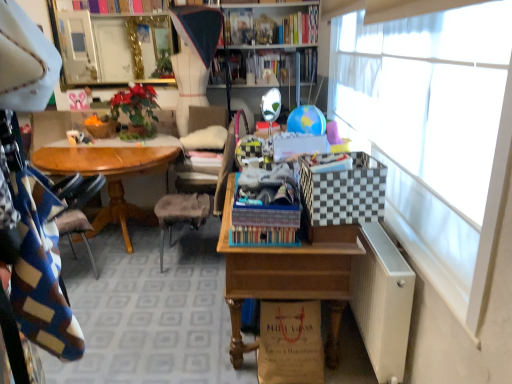
Question: From a real-world perspective, is wooden desk at center positioned over white metallic radiator at lower right based on gravity?

Choices:
 (A) no
 (B) yes

Answer: (A)

Question: From the image's perspective, does wooden desk at center appear lower than white metallic radiator at lower right?

Choices:
 (A) no
 (B) yes

Answer: (A)

Question: Can you confirm if wooden desk at center is positioned to the right of white metallic radiator at lower right?

Choices:
 (A) no
 (B) yes

Answer: (A)

Question: Considering the relative positions of wooden desk at center and white metallic radiator at lower right in the image provided, is wooden desk at center to the left of white metallic radiator at lower right from the viewer's perspective?

Choices:
 (A) no
 (B) yes

Answer: (B)

Question: Are wooden desk at center and white metallic radiator at lower right located far from each other?

Choices:
 (A) yes
 (B) no

Answer: (B)

Question: Looking at the image, does hardcover book at upper center, the first book in the left-to-right sequence, seem bigger or smaller compared to green leafy plant at center?

Choices:
 (A) big
 (B) small

Answer: (B)

Question: Considering the positions of point (218, 49) and point (148, 129), is point (218, 49) closer or farther from the camera than point (148, 129)?

Choices:
 (A) closer
 (B) farther

Answer: (B)

Question: From a real-world perspective, relative to green leafy plant at center, is hardcover book at upper center, arranged as the second book when viewed from the right, vertically above or below?

Choices:
 (A) above
 (B) below

Answer: (A)

Question: From the image's perspective, is hardcover book at upper center, which ranks as the first book in bottom-to-top order, positioned above or below green leafy plant at center?

Choices:
 (A) below
 (B) above

Answer: (B)

Question: Is wooden desk at center in front of or behind black and white checkered picnic basket at right in the image?

Choices:
 (A) front
 (B) behind

Answer: (B)

Question: From their relative heights in the image, would you say wooden desk at center is taller or shorter than black and white checkered picnic basket at right?

Choices:
 (A) short
 (B) tall

Answer: (B)

Question: Is wooden desk at center to the left or to the right of black and white checkered picnic basket at right in the image?

Choices:
 (A) right
 (B) left

Answer: (B)

Question: In terms of width, does wooden desk at center look wider or thinner when compared to black and white checkered picnic basket at right?

Choices:
 (A) thin
 (B) wide

Answer: (B)

Question: From the image's perspective, is hardcover books at upper center, the first book from the right, above or below white sheer curtain at right?

Choices:
 (A) below
 (B) above

Answer: (B)

Question: Based on their positions, is hardcover books at upper center, which is the second book in bottom-to-top order, located to the left or right of white sheer curtain at right?

Choices:
 (A) right
 (B) left

Answer: (B)